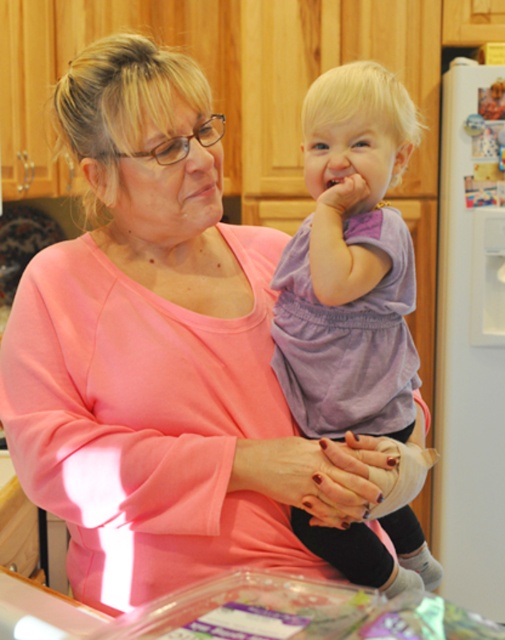
What do you see at coordinates (349, 262) in the screenshot? Image resolution: width=505 pixels, height=640 pixels. I see `purple soft fabric dress at center` at bounding box center [349, 262].

Identify the location of purple soft fabric dress at center. (349, 262).

At what (x,y) coordinates should I click in order to perform the action: click on purple soft fabric dress at center. Please return your answer as a coordinate pair (x, y). Looking at the image, I should click on (349, 262).